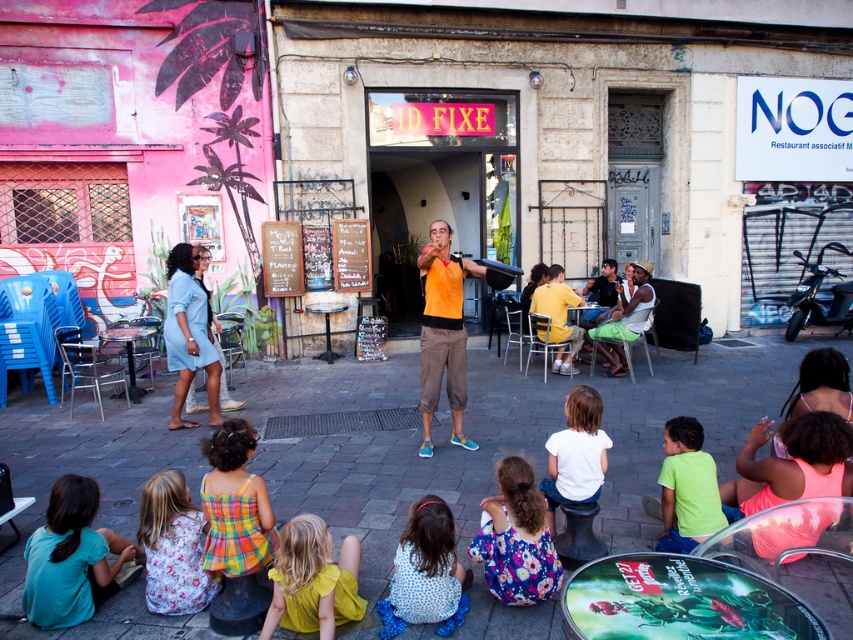
You are a photographer standing at the edge of the square. You want to capture a photo that includes both the polka dot fabric dress at lower center and the matte orange shirt at center. Based on their positions, where should you position your camera to ensure both are in frame?

Since the polka dot fabric dress at lower center is located below the matte orange shirt at center, you should position your camera at a lower angle to include both objects in the frame.

You are standing in the European town square and want to locate the teal cotton shirt at lower left. According to the coordinates provided, where should you look to find it?

The teal cotton shirt at lower left is located at point (71, 557).

You are a fashion designer observing the lively street scene. You notice two dresses in the crowd. Which dress has a larger size? The options are the matte yellow dress at lower center and the floral fabric dress at lower left.

The matte yellow dress at lower center is bigger than the floral fabric dress at lower left, so the matte yellow dress at lower center has a larger size.